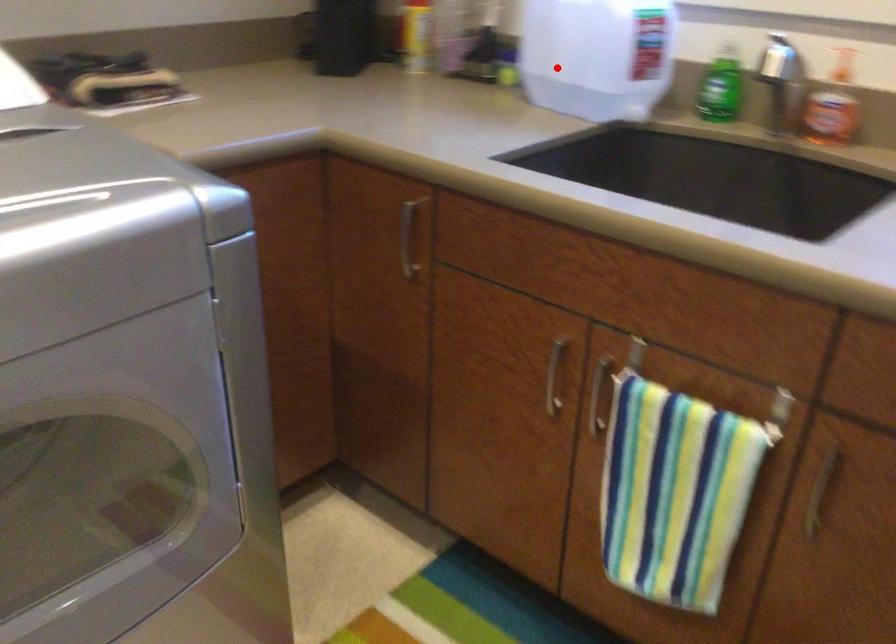
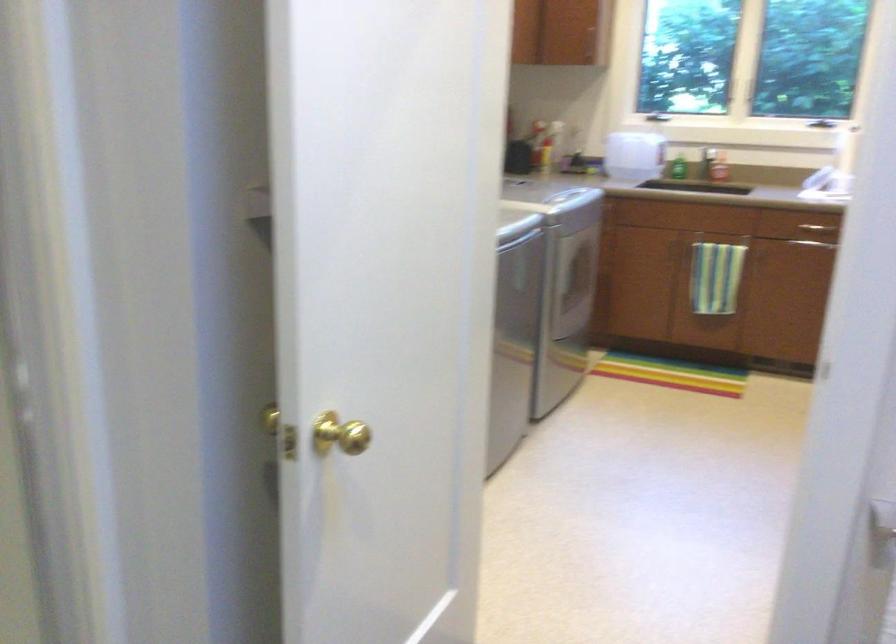
Question: I am providing you with two images of the same scene from different viewpoints. Image1 has a red point marked. In image2, the corresponding 3D location appears at what relative position? Reply with the corresponding letter.

Choices:
 (A) Closer
 (B) Farther

Answer: (B)